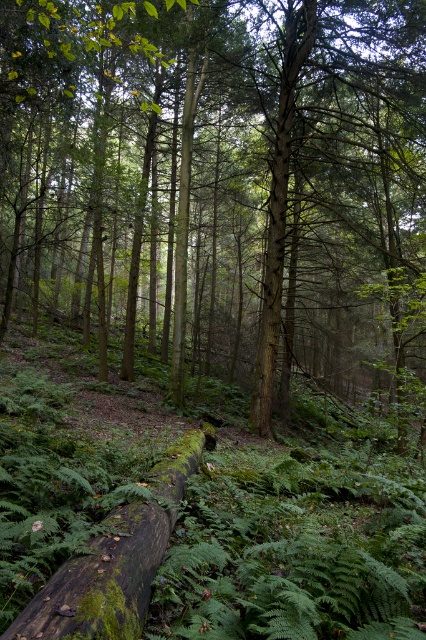
Who is taller, green rough bark tree at center or green mossy log at center?

green rough bark tree at center

Is green rough bark tree at center smaller than green mossy log at center?

Incorrect, green rough bark tree at center is not smaller in size than green mossy log at center.

Is point (69, 312) closer to viewer compared to point (42, 609)?

That is False.

I want to click on green rough bark tree at center, so click(221, 184).